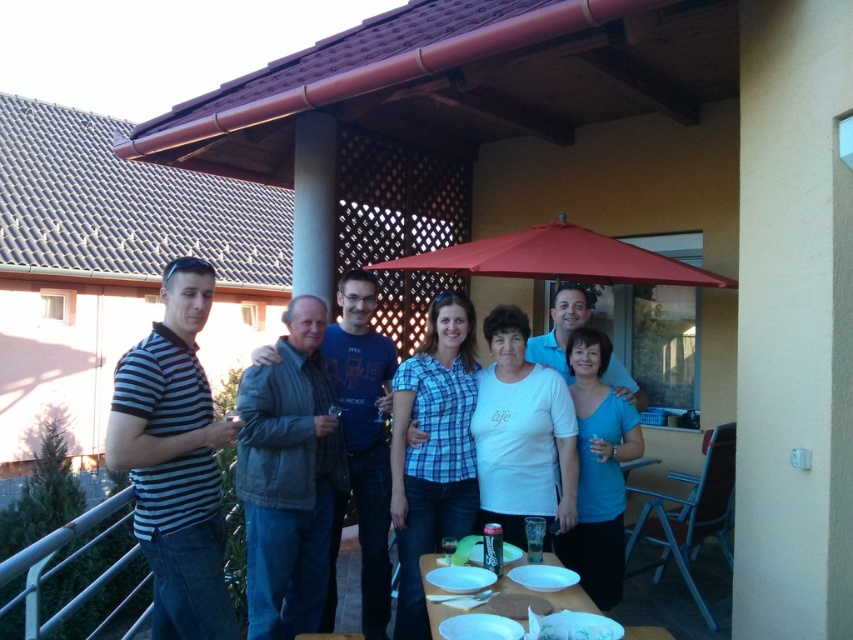
Can you confirm if white cotton shirt at center is taller than red fabric umbrella at upper center?

Correct, white cotton shirt at center is much taller as red fabric umbrella at upper center.

What are the coordinates of `white cotton shirt at center` in the screenshot? It's located at (521, 435).

Describe the element at coordinates (521, 435) in the screenshot. I see `white cotton shirt at center` at that location.

Find the location of a particular element. white cotton shirt at center is located at coordinates click(521, 435).

Who is positioned more to the left, white cotton shirt at center or blue matte shirt at center?

white cotton shirt at center

This screenshot has height=640, width=853. Identify the location of white cotton shirt at center. (521, 435).

Find the location of a particular element. This screenshot has height=640, width=853. white cotton shirt at center is located at coordinates (521, 435).

Which of these two, blue matte shirt at center or red fabric umbrella at upper center, stands shorter?

Standing shorter between the two is red fabric umbrella at upper center.

Which of these two, blue matte shirt at center or red fabric umbrella at upper center, stands taller?

blue matte shirt at center is taller.

Between point (624, 444) and point (582, 273), which one is positioned behind?

The point (582, 273) is behind.

Where is `blue matte shirt at center`? blue matte shirt at center is located at coordinates pos(598,470).